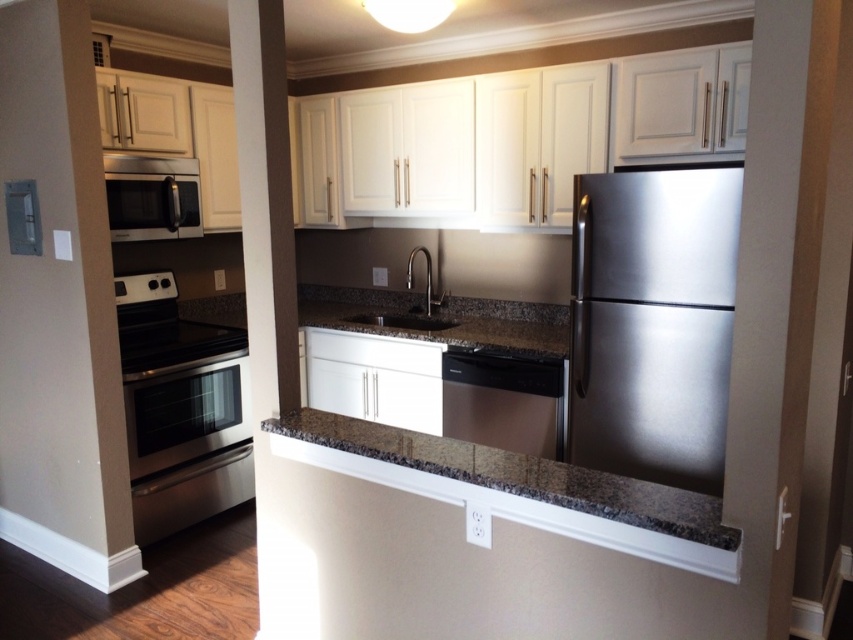
Can you confirm if stainless steel refrigerator at right is bigger than granite countertop at center?

Yes.

Is stainless steel refrigerator at right to the left of granite countertop at center from the viewer's perspective?

In fact, stainless steel refrigerator at right is to the right of granite countertop at center.

Describe the element at coordinates (653, 321) in the screenshot. I see `stainless steel refrigerator at right` at that location.

Where is `stainless steel refrigerator at right`? The width and height of the screenshot is (853, 640). stainless steel refrigerator at right is located at coordinates [653, 321].

Does satin stainless steel dishwasher at center have a larger size compared to granite sink at center?

No.

Does satin stainless steel dishwasher at center have a greater width compared to granite sink at center?

No, satin stainless steel dishwasher at center is not wider than granite sink at center.

Is point (476, 378) positioned behind point (427, 307)?

No.

The width and height of the screenshot is (853, 640). Find the location of `satin stainless steel dishwasher at center`. satin stainless steel dishwasher at center is located at coordinates (503, 401).

Does stainless steel refrigerator at right come behind stainless steel oven at left?

That is False.

Which is below, stainless steel refrigerator at right or stainless steel oven at left?

stainless steel oven at left

Who is more distant from viewer, [695,339] or [122,349]?

The point [122,349] is more distant.

The image size is (853, 640). I want to click on stainless steel refrigerator at right, so click(653, 321).